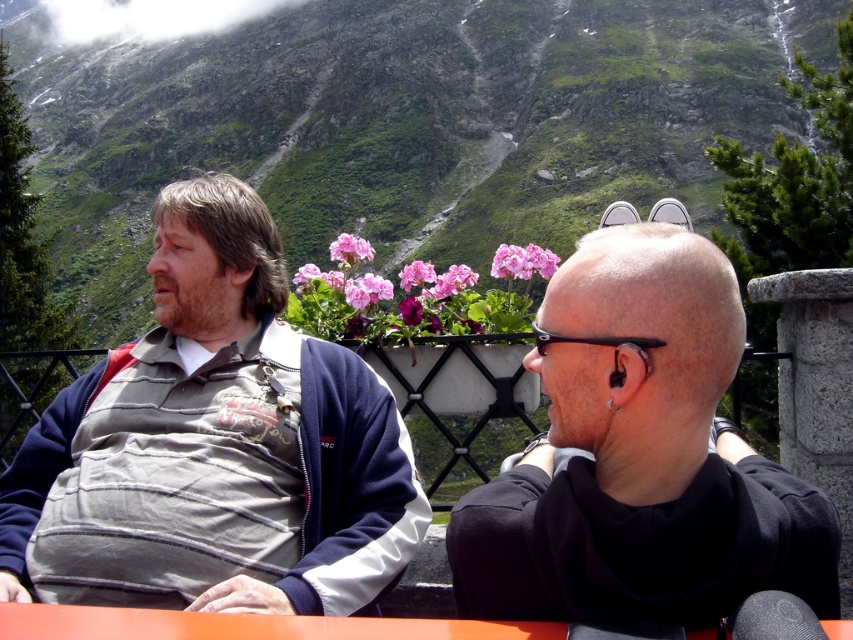
You are a photographer trying to capture a closeup shot of both the gray striped shirt at left and the black matte hair at center. Given that your camera can focus on objects within a 6.5 meter range, will you be able to capture both subjects in focus?

The gray striped shirt at left is 7.10 meters away from black matte hair at center. Since the distance between them exceeds the camera focus range of 6.5 meters, you cannot capture both subjects in focus simultaneously.

You are standing in front of a large outdoor table where two people are sitting. The person on the left is wearing a gray striped shirt. You want to place a small gift on the table between the gray striped shirt at left and the viewer. Is there enough space for the gift?

The distance between the gray striped shirt at left and the viewer is 72.91 feet, so there is sufficient space to place the gift on the table between them.

You are a photographer trying to capture a closeup of the gray striped shirt at left. Based on the coordinates provided, where should you aim your camera?

The gray striped shirt at left is located at coordinates point (213,445), so aim your camera at that position to capture the closeup.